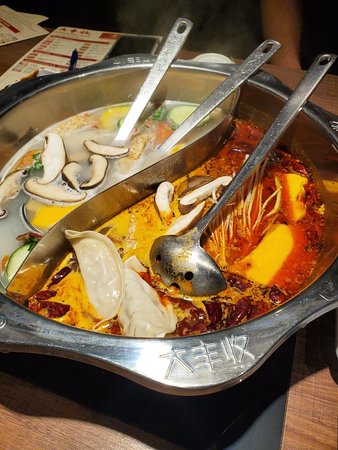
Image resolution: width=338 pixels, height=450 pixels. Identify the location of pen. (75, 58).